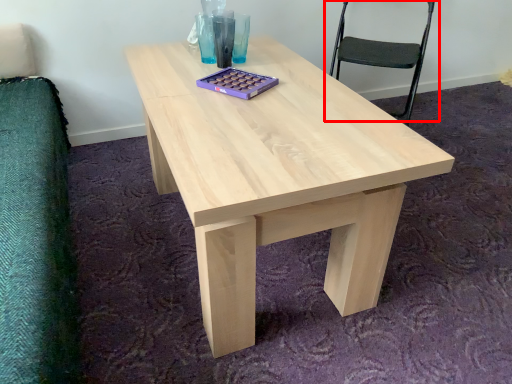
Question: Observing the image, what is the correct spatial positioning of chair (annotated by the red box) in reference to coffee table?

Choices:
 (A) left
 (B) right

Answer: (A)